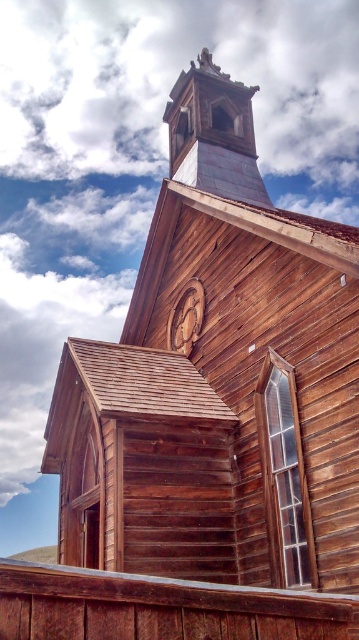
Is wooden steeple at upper center taller than wooden carving at center?

Correct, wooden steeple at upper center is much taller as wooden carving at center.

What do you see at coordinates (213, 132) in the screenshot? I see `wooden steeple at upper center` at bounding box center [213, 132].

Does point (250, 152) come farther from viewer compared to point (185, 291)?

Yes, it is.

Locate an element on the screen. wooden steeple at upper center is located at coordinates (213, 132).